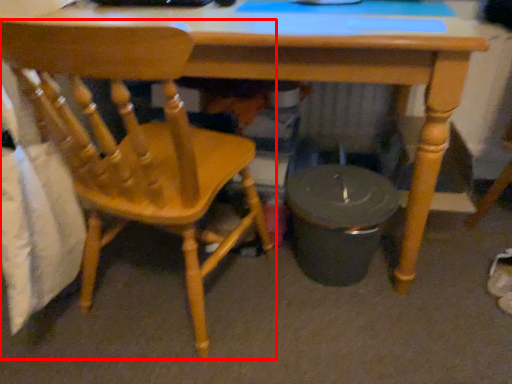
Question: Where is chair (annotated by the red box) located in relation to desk in the image?

Choices:
 (A) right
 (B) left

Answer: (B)